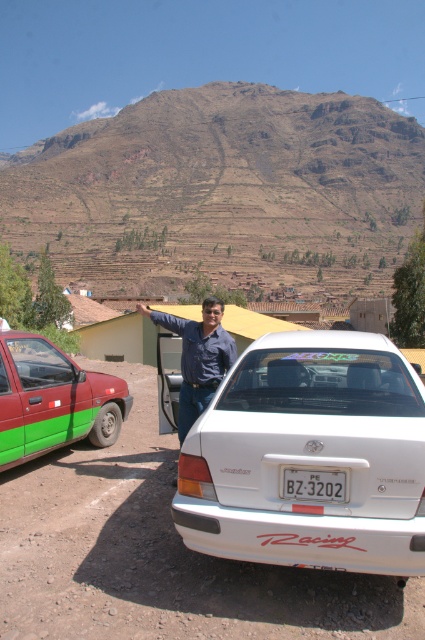
Question: Does white glossy sedan at center lie behind green matte car at left?

Choices:
 (A) yes
 (B) no

Answer: (B)

Question: Does white glossy sedan at center have a greater width compared to blue denim shirt at center?

Choices:
 (A) yes
 (B) no

Answer: (A)

Question: Can you confirm if green matte car at left is positioned to the left of white plastic license plate at center?

Choices:
 (A) yes
 (B) no

Answer: (A)

Question: Which object appears closest to the camera in this image?

Choices:
 (A) green matte car at left
 (B) white glossy sedan at center
 (C) blue denim shirt at center
 (D) white plastic license plate at center

Answer: (B)

Question: Which point is closer to the camera?

Choices:
 (A) (289, 497)
 (B) (345, 570)
 (C) (39, 342)
 (D) (206, 368)

Answer: (B)

Question: Among these points, which one is nearest to the camera?

Choices:
 (A) (294, 476)
 (B) (193, 371)
 (C) (255, 438)
 (D) (14, 378)

Answer: (A)